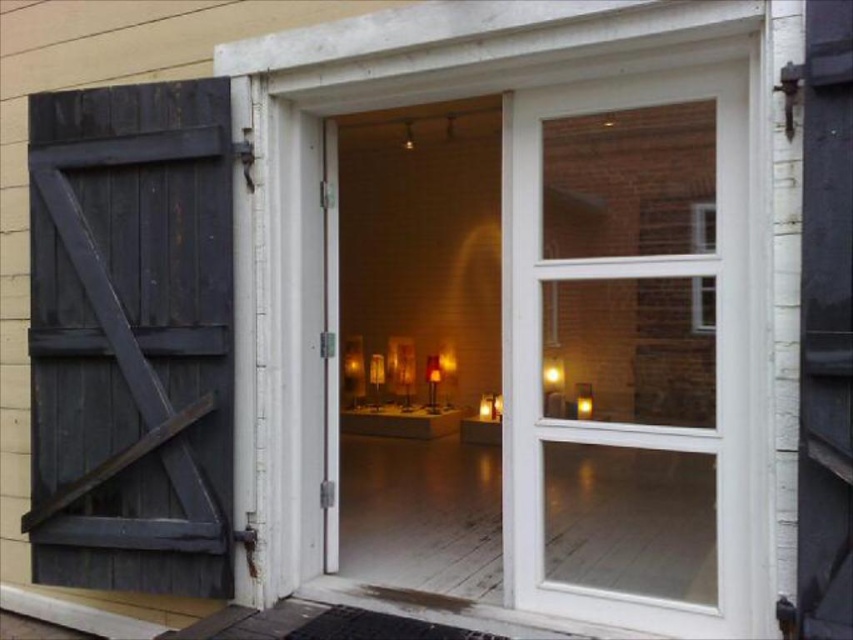
Does dark wood barn door at left appear under clear glass window at upper right?

Yes.

Between dark wood barn door at left and clear glass window at upper right, which one is positioned lower?

dark wood barn door at left is lower down.

Find the location of a particular element. The width and height of the screenshot is (853, 640). dark wood barn door at left is located at coordinates (131, 337).

Identify the location of dark wood barn door at left. (131, 337).

Does point (682, 419) lie in front of point (712, 317)?

No, (682, 419) is further to viewer.

Does point (735, 400) come farther from viewer compared to point (703, 220)?

No, (735, 400) is in front of (703, 220).

The image size is (853, 640). I want to click on clear glass door at center, so coord(630,346).

Locate an element on the screen. The image size is (853, 640). clear glass door at center is located at coordinates (630, 346).

Does clear glass door at center have a lesser height compared to dark wood barn door at left?

Yes, clear glass door at center is shorter than dark wood barn door at left.

Which is in front, point (605, 145) or point (108, 508)?

Point (605, 145)

Describe the element at coordinates (630, 346) in the screenshot. Image resolution: width=853 pixels, height=640 pixels. I see `clear glass door at center` at that location.

What are the coordinates of `clear glass door at center` in the screenshot? It's located at (630, 346).